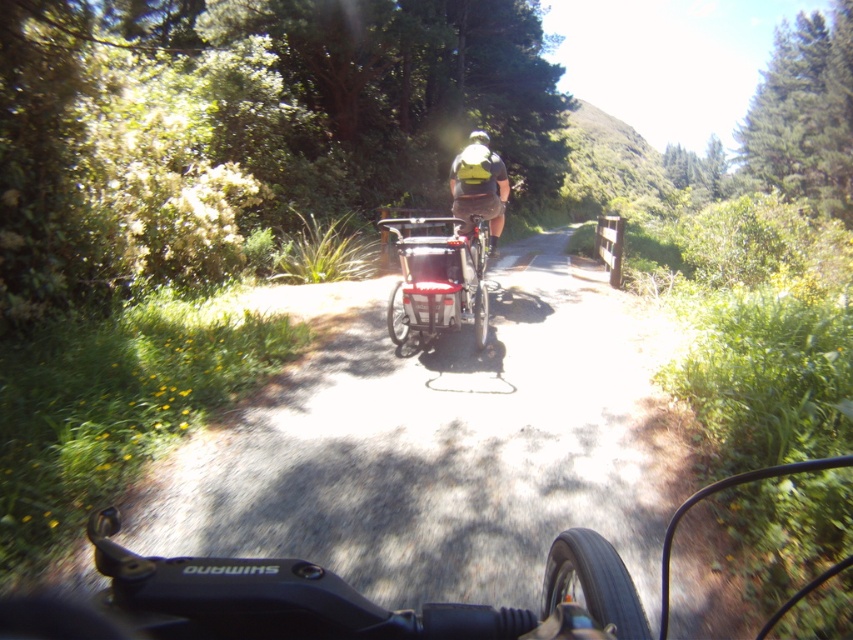
You are riding a bicycle and want to know if there is enough space between the smooth asphalt road at center and the metallic silver bicycle at center to safely pass through. Can you fit through the gap?

The smooth asphalt road at center and metallic silver bicycle at center are 1.03 meters apart. Since the gap is 1.03 meters wide, it depends on the width of your bicycle. If your bicycle is narrower than 1.03 meters, you can safely pass through the gap.

You are a cyclist riding on a path flanked by greenery. You have a yellow fabric backpack at center. Where is the yellow fabric backpack located relative to your current position?

The yellow fabric backpack at center is located at point 0.297 along the x axis and 0.563 along the y axis relative to your current position.

You are a cyclist preparing for a ride and notice the yellow fabric backpack at center and the white matte bicycle helmet at upper center. Which item is wider?

The white matte bicycle helmet at upper center is wider than the yellow fabric backpack at center.